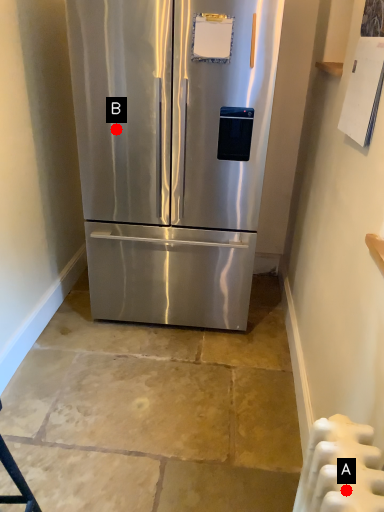
Question: Two points are circled on the image, labeled by A and B beside each circle. Which point is farther from the camera taking this photo?

Choices:
 (A) A is further
 (B) B is further

Answer: (B)